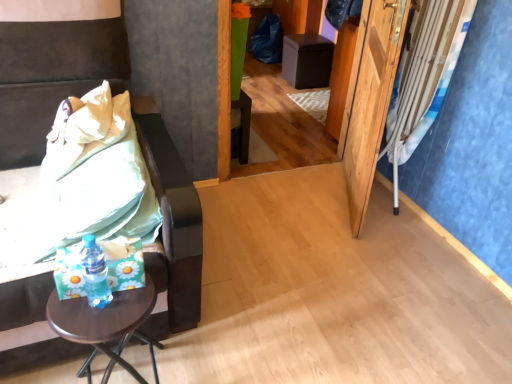
How much space does black leather ottoman at center, placed as the first furniture when sorted from right to left, occupy vertically?

The height of black leather ottoman at center, placed as the first furniture when sorted from right to left, is 19.85 inches.

What do you see at coordinates (106, 325) in the screenshot? I see `brown wooden table at lower left` at bounding box center [106, 325].

At what (x,y) coordinates should I click in order to perform the action: click on brown wooden side table at left, arranged as the 2th furniture when viewed from the top. Please return your answer as a coordinate pair (x, y). This screenshot has width=512, height=384. Looking at the image, I should click on (52, 77).

Locate an element on the screen. black leather ottoman at center, placed as the first furniture when sorted from right to left is located at coordinates (307, 60).

Which object is positioned more to the right, green fabric bedsheet at left or brown wooden side table at left, the first furniture in the bottom-to-top sequence?

green fabric bedsheet at left is more to the right.

Does green fabric bedsheet at left touch brown wooden side table at left, which appears as the 1th furniture when viewed from the left?

They are not placed beside each other.

Considering the relative sizes of green fabric bedsheet at left and brown wooden side table at left, marked as the 1th furniture in a front-to-back arrangement, in the image provided, is green fabric bedsheet at left smaller than brown wooden side table at left, marked as the 1th furniture in a front-to-back arrangement,?

Yes.

Where is `table below the blue fabric curtain at right (from the image's perspective)`? The width and height of the screenshot is (512, 384). table below the blue fabric curtain at right (from the image's perspective) is located at coordinates (106, 325).

Considering the relative positions of brown wooden table at lower left and blue fabric curtain at right in the image provided, is brown wooden table at lower left to the left or to the right of blue fabric curtain at right?

brown wooden table at lower left is positioned on blue fabric curtain at right's left side.

Which is behind, brown wooden table at lower left or blue fabric curtain at right?

blue fabric curtain at right is further from the camera.

From the image's perspective, is brown wooden table at lower left below blue fabric curtain at right?

Yes.

Is brown wooden side table at left, the first furniture in the bottom-to-top sequence, positioned before blue fabric curtain at right?

That is True.

Is blue fabric curtain at right completely or partially inside brown wooden side table at left, marked as the second furniture in a right-to-left arrangement?

No, brown wooden side table at left, marked as the second furniture in a right-to-left arrangement, does not contain blue fabric curtain at right.

Is the surface of brown wooden side table at left, the first furniture in the bottom-to-top sequence, in direct contact with blue fabric curtain at right?

They are not placed beside each other.

From the image's perspective, which is below, brown wooden table at lower left or black leather ottoman at center, placed as the first furniture when sorted from right to left?

Result: brown wooden table at lower left is shown below in the image.

Is brown wooden table at lower left smaller than black leather ottoman at center, acting as the second furniture starting from the front?

Yes, brown wooden table at lower left is smaller than black leather ottoman at center, acting as the second furniture starting from the front.

In the scene shown: In the image, is brown wooden table at lower left positioned in front of or behind black leather ottoman at center, the first furniture viewed from the back?

Visually, brown wooden table at lower left is located in front of black leather ottoman at center, the first furniture viewed from the back.

Is translucent plastic bottle at lower left bigger than brown wooden side table at left, marked as the second furniture in a right-to-left arrangement?

Incorrect, translucent plastic bottle at lower left is not larger than brown wooden side table at left, marked as the second furniture in a right-to-left arrangement.

From a real-world perspective, who is located higher, translucent plastic bottle at lower left or brown wooden side table at left, marked as the second furniture in a right-to-left arrangement?

translucent plastic bottle at lower left, from a real-world perspective.

Is translucent plastic bottle at lower left facing away from brown wooden side table at left, marked as the second furniture in a right-to-left arrangement?

Yes, translucent plastic bottle at lower left is facing away from brown wooden side table at left, marked as the second furniture in a right-to-left arrangement.

Between translucent plastic bottle at lower left and wooden screen door at right, which one appears on the right side from the viewer's perspective?

Positioned to the right is wooden screen door at right.

The image size is (512, 384). I want to click on bottle in front of the wooden screen door at right, so click(95, 273).

Is translucent plastic bottle at lower left turned away from wooden screen door at right?

No, translucent plastic bottle at lower left's orientation is not away from wooden screen door at right.

Would you say translucent plastic bottle at lower left is outside wooden screen door at right?

translucent plastic bottle at lower left is positioned outside wooden screen door at right.

From the image's perspective, which one is positioned higher, black leather ottoman at center, which appears as the 2th furniture when viewed from the left, or blue fabric curtain at right?

black leather ottoman at center, which appears as the 2th furniture when viewed from the left, from the image's perspective.

Does point (305, 38) appear closer or farther from the camera than point (405, 102)?

Point (305, 38) appears to be farther away from the viewer than point (405, 102).

In the image, is black leather ottoman at center, placed as the first furniture when sorted from right to left, on the left side or the right side of blue fabric curtain at right?

Based on their positions, black leather ottoman at center, placed as the first furniture when sorted from right to left, is located to the left of blue fabric curtain at right.

Locate an element on the screen. Image resolution: width=512 pixels, height=384 pixels. sheet that appears behind the brown wooden side table at left, arranged as the 2th furniture when viewed from the top is located at coordinates (102, 199).

Where is `curtain that appears above the brown wooden table at lower left (from the image's perspective)`? This screenshot has width=512, height=384. curtain that appears above the brown wooden table at lower left (from the image's perspective) is located at coordinates (426, 75).

Which object lies nearer to the anchor point blue fabric curtain at right, brown wooden table at lower left or wooden screen door at right?

wooden screen door at right lies closer to blue fabric curtain at right than the other object.

From the image, which object appears to be nearer to blue fabric curtain at right, black leather ottoman at center, acting as the 2th furniture starting from the bottom, or green fabric bedsheet at left?

Based on the image, green fabric bedsheet at left appears to be nearer to blue fabric curtain at right.

From the image, which object appears to be nearer to blue fabric curtain at right, black leather ottoman at center, which appears as the 2th furniture when viewed from the left, or translucent plastic bottle at lower left?

Based on the image, translucent plastic bottle at lower left appears to be nearer to blue fabric curtain at right.

Based on their spatial positions, is brown wooden side table at left, which appears as the 1th furniture when viewed from the left, or green fabric bedsheet at left further from wooden screen door at right?

green fabric bedsheet at left.

When comparing their distances from brown wooden table at lower left, does translucent plastic bottle at lower left or green fabric bedsheet at left seem closer?

translucent plastic bottle at lower left.

Which object lies further to the anchor point brown wooden side table at left, which ranks as the second furniture in back-to-front order, translucent plastic bottle at lower left or green fabric bedsheet at left?

translucent plastic bottle at lower left is positioned further to the anchor brown wooden side table at left, which ranks as the second furniture in back-to-front order.

Which object lies further to the anchor point black leather ottoman at center, placed as the first furniture when sorted from right to left, blue fabric curtain at right or wooden screen door at right?

blue fabric curtain at right.

From the image, which object appears to be farther from green fabric bedsheet at left, translucent plastic bottle at lower left or black leather ottoman at center, acting as the second furniture starting from the front?

Among the two, black leather ottoman at center, acting as the second furniture starting from the front, is located further to green fabric bedsheet at left.

Where is `screen door between brown wooden side table at left, marked as the second furniture in a right-to-left arrangement, and blue fabric curtain at right, in the horizontal direction`? screen door between brown wooden side table at left, marked as the second furniture in a right-to-left arrangement, and blue fabric curtain at right, in the horizontal direction is located at coordinates (369, 99).

The height and width of the screenshot is (384, 512). I want to click on screen door between green fabric bedsheet at left and blue fabric curtain at right, so click(x=369, y=99).

Identify the location of table located between brown wooden side table at left, marked as the 1th furniture in a front-to-back arrangement, and wooden screen door at right in the left-right direction. (106, 325).

Find the location of a particular element. curtain between translucent plastic bottle at lower left and black leather ottoman at center, the first furniture viewed from the back, from front to back is located at coordinates (426, 75).